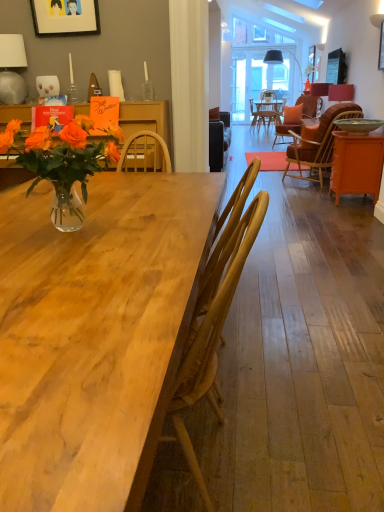
How much space does matte red lampshade at upper right, which ranks as the first lamp in back-to-front order, occupy horizontally?

matte red lampshade at upper right, which ranks as the first lamp in back-to-front order, is 12.46 inches in width.

What is the approximate width of matte black picture frame at upper left, positioned as the first picture frame in left-to-right order?

matte black picture frame at upper left, positioned as the first picture frame in left-to-right order, is 3.59 inches wide.

Describe the element at coordinates (95, 335) in the screenshot. I see `wooden table at center` at that location.

Where is `wooden chair at center, arranged as the first chair when ordered from the bottom`? The width and height of the screenshot is (384, 512). wooden chair at center, arranged as the first chair when ordered from the bottom is located at coordinates click(212, 335).

How much space does wooden chair at center, arranged as the first chair when ordered from the bottom, occupy horizontally?

wooden chair at center, arranged as the first chair when ordered from the bottom, is 55.11 centimeters wide.

Where is `matte red lampshade at upper right, which ranks as the 2th lamp in front-to-back order`? Image resolution: width=384 pixels, height=512 pixels. matte red lampshade at upper right, which ranks as the 2th lamp in front-to-back order is located at coordinates (340, 92).

From a real-world perspective, is wooden chair at center, the second chair from the back, on wooden picture frame at upper right, the 1th picture frame viewed from the back?

No.

From the image's perspective, which one is positioned higher, wooden chair at center, which ranks as the 1th chair in front-to-back order, or wooden picture frame at upper right, the 1th picture frame viewed from the back?

From the image's view, wooden picture frame at upper right, the 1th picture frame viewed from the back, is above.

In terms of size, does wooden chair at center, arranged as the first chair when ordered from the bottom, appear bigger or smaller than wooden picture frame at upper right, which ranks as the second picture frame in front-to-back order?

Considering their sizes, wooden chair at center, arranged as the first chair when ordered from the bottom, takes up more space than wooden picture frame at upper right, which ranks as the second picture frame in front-to-back order.

Based on the photo, measure the distance between wooden chair at center, arranged as the first chair when ordered from the bottom, and wooden picture frame at upper right, the 1th picture frame viewed from the back.

They are 6.12 meters apart.

Between matte red lampshade at upper right, the 1th lamp from the top, and orange matte cabinet at right, which one appears on the left side from the viewer's perspective?

From the viewer's perspective, orange matte cabinet at right appears more on the left side.

Is matte red lampshade at upper right, which ranks as the first lamp in back-to-front order, taller than orange matte cabinet at right?

Incorrect, the height of matte red lampshade at upper right, which ranks as the first lamp in back-to-front order, is not larger of that of orange matte cabinet at right.

Considering their positions, is matte red lampshade at upper right, placed as the second lamp when sorted from left to right, located in front of or behind orange matte cabinet at right?

matte red lampshade at upper right, placed as the second lamp when sorted from left to right, is behind orange matte cabinet at right.

From a real-world perspective, does matte red lampshade at upper right, the 1th lamp positioned from the right, sit lower than orange matte cabinet at right?

No, from a real-world perspective, matte red lampshade at upper right, the 1th lamp positioned from the right, is not under orange matte cabinet at right.

How many degrees apart are the facing directions of orange matte cabinet at right and matte red lampshade at upper right, placed as the second lamp when sorted from left to right?

The angle between the facing direction of orange matte cabinet at right and the facing direction of matte red lampshade at upper right, placed as the second lamp when sorted from left to right, is 2.7 degrees.

Is point (372, 164) closer or farther from the camera than point (334, 93)?

Point (372, 164).

Based on the photo, from the image's perspective, does orange matte cabinet at right appear higher than matte red lampshade at upper right, placed as the second lamp when sorted from left to right?

No, from the image's perspective, orange matte cabinet at right is not on top of matte red lampshade at upper right, placed as the second lamp when sorted from left to right.

From a real-world perspective, is orange matte cabinet at right physically below matte red lampshade at upper right, which ranks as the 2th lamp in front-to-back order?

Correct, in the physical world, orange matte cabinet at right is lower than matte red lampshade at upper right, which ranks as the 2th lamp in front-to-back order.

Is point (352, 92) farther from camera compared to point (43, 31)?

Yes, it is.

From a real-world perspective, is matte red lampshade at upper right, the 1th lamp from the top, positioned over matte black picture frame at upper left, positioned as the first picture frame in left-to-right order, based on gravity?

No, from a real-world perspective, matte red lampshade at upper right, the 1th lamp from the top, is not on top of matte black picture frame at upper left, positioned as the first picture frame in left-to-right order.

Is matte red lampshade at upper right, the 1th lamp positioned from the right, thinner than matte black picture frame at upper left, which appears as the second picture frame when viewed from the back?

No, matte red lampshade at upper right, the 1th lamp positioned from the right, is not thinner than matte black picture frame at upper left, which appears as the second picture frame when viewed from the back.

Can we say matte red lampshade at upper right, the 1th lamp positioned from the right, lies outside matte black picture frame at upper left, which appears as the second picture frame when viewed from the back?

matte red lampshade at upper right, the 1th lamp positioned from the right, lies outside matte black picture frame at upper left, which appears as the second picture frame when viewed from the back,'s area.

From their relative heights in the image, would you say wooden picture frame at upper right, which ranks as the second picture frame in front-to-back order, is taller or shorter than orange matte cabinet at right?

Considering their sizes, wooden picture frame at upper right, which ranks as the second picture frame in front-to-back order, has less height than orange matte cabinet at right.

Looking at the image, does wooden picture frame at upper right, which ranks as the second picture frame in front-to-back order, seem bigger or smaller compared to orange matte cabinet at right?

wooden picture frame at upper right, which ranks as the second picture frame in front-to-back order, is smaller than orange matte cabinet at right.

What's the angular difference between wooden picture frame at upper right, the 1th picture frame viewed from the back, and orange matte cabinet at right's facing directions?

1.73 degrees.

Does white ceramic lamp at upper left, acting as the 2th lamp starting from the back, turn towards orange matte cabinet at right?

No, white ceramic lamp at upper left, acting as the 2th lamp starting from the back, does not turn towards orange matte cabinet at right.

Can you confirm if white ceramic lamp at upper left, arranged as the second lamp when viewed from the right, is taller than orange matte cabinet at right?

In fact, white ceramic lamp at upper left, arranged as the second lamp when viewed from the right, may be shorter than orange matte cabinet at right.

Identify the location of table on the right of white ceramic lamp at upper left, which ranks as the second lamp in top-to-bottom order. (356, 164).

Considering the sizes of white ceramic lamp at upper left, arranged as the second lamp when viewed from the right, and orange matte cabinet at right in the image, is white ceramic lamp at upper left, arranged as the second lamp when viewed from the right, wider or thinner than orange matte cabinet at right?

In the image, white ceramic lamp at upper left, arranged as the second lamp when viewed from the right, appears to be more narrow than orange matte cabinet at right.

Would you say orange matte cabinet at right is outside white ceramic lamp at upper left, which ranks as the second lamp in top-to-bottom order?

Yes, orange matte cabinet at right is not within white ceramic lamp at upper left, which ranks as the second lamp in top-to-bottom order.

From the image's perspective, is orange matte cabinet at right beneath white ceramic lamp at upper left, which is counted as the first lamp, starting from the bottom?

Yes, from the image's perspective, orange matte cabinet at right is below white ceramic lamp at upper left, which is counted as the first lamp, starting from the bottom.

From the picture: Is orange matte cabinet at right further to camera compared to white ceramic lamp at upper left, which appears as the 1th lamp when viewed from the left?

Yes.

Considering the sizes of objects orange matte cabinet at right and white ceramic lamp at upper left, placed as the first lamp when sorted from front to back, in the image provided, who is thinner, orange matte cabinet at right or white ceramic lamp at upper left, placed as the first lamp when sorted from front to back,?

white ceramic lamp at upper left, placed as the first lamp when sorted from front to back, is thinner.

The height and width of the screenshot is (512, 384). I want to click on chair that is the 2nd one when counting downward from the wooden picture frame at upper right, which is counted as the second picture frame, starting from the left (from the image's perspective), so click(212, 335).

This screenshot has height=512, width=384. Identify the location of the 1st lamp positioned above the orange matte cabinet at right (from a real-world perspective). (340, 92).

Looking at this image, based on their spatial positions, is matte red lampshade at upper right, the 1th lamp from the top, or translucent glass vase at left further from orange matte cabinet at right?

translucent glass vase at left lies further to orange matte cabinet at right than the other object.

Which object lies further to the anchor point orange matte cabinet at right, wooden table at center or white ceramic lamp at upper left, which is counted as the first lamp, starting from the bottom?

Among the two, wooden table at center is located further to orange matte cabinet at right.

From the image, which object appears to be nearer to orange matte cabinet at right, wooden picture frame at upper right, the 1th picture frame viewed from the back, or orange woven chair at right, which is the second chair in front-to-back order?

orange woven chair at right, which is the second chair in front-to-back order, is closer to orange matte cabinet at right.

Estimate the real-world distances between objects in this image. Which object is further from orange woven chair at right, marked as the second chair in a left-to-right arrangement, wooden picture frame at upper right, the 1th picture frame viewed from the back, or wooden table at center?

wooden table at center.

Looking at the image, which one is located further to wooden picture frame at upper right, which is counted as the 1th picture frame, starting from the right, translucent glass vase at left or orange matte cabinet at right?

Based on the image, translucent glass vase at left appears to be further to wooden picture frame at upper right, which is counted as the 1th picture frame, starting from the right.

Looking at the image, which one is located closer to wooden picture frame at upper right, which ranks as the second picture frame in front-to-back order, white ceramic lamp at upper left, placed as the first lamp when sorted from front to back, or wooden table at center?

white ceramic lamp at upper left, placed as the first lamp when sorted from front to back.

Considering their positions, is matte black picture frame at upper left, which appears as the second picture frame when viewed from the back, positioned further to matte red lampshade at upper right, which ranks as the 2th lamp in front-to-back order, than white ceramic lamp at upper left, which is counted as the first lamp, starting from the bottom?

white ceramic lamp at upper left, which is counted as the first lamp, starting from the bottom, lies further to matte red lampshade at upper right, which ranks as the 2th lamp in front-to-back order, than the other object.

When comparing their distances from orange woven chair at right, marked as the 1th chair in a top-to-bottom arrangement, does matte black picture frame at upper left, positioned as the first picture frame in left-to-right order, or wooden chair at center, the first chair viewed from the left, seem further?

wooden chair at center, the first chair viewed from the left, lies further to orange woven chair at right, marked as the 1th chair in a top-to-bottom arrangement, than the other object.

Where is `table between wooden table at center and matte red lampshade at upper right, which ranks as the 2th lamp in front-to-back order, along the z-axis`? This screenshot has height=512, width=384. table between wooden table at center and matte red lampshade at upper right, which ranks as the 2th lamp in front-to-back order, along the z-axis is located at coordinates (356, 164).

The image size is (384, 512). What are the coordinates of `houseplant located between white ceramic lamp at upper left, arranged as the second lamp when viewed from the right, and orange matte cabinet at right in the left-right direction` in the screenshot? It's located at (63, 162).

Where is `table positioned between wooden table at center and orange woven chair at right, which appears as the second chair when ordered from the bottom, from near to far`? This screenshot has height=512, width=384. table positioned between wooden table at center and orange woven chair at right, which appears as the second chair when ordered from the bottom, from near to far is located at coordinates (356, 164).

I want to click on table between white ceramic lamp at upper left, which is counted as the first lamp, starting from the bottom, and wooden picture frame at upper right, which is counted as the second picture frame, starting from the left, from left to right, so click(x=356, y=164).